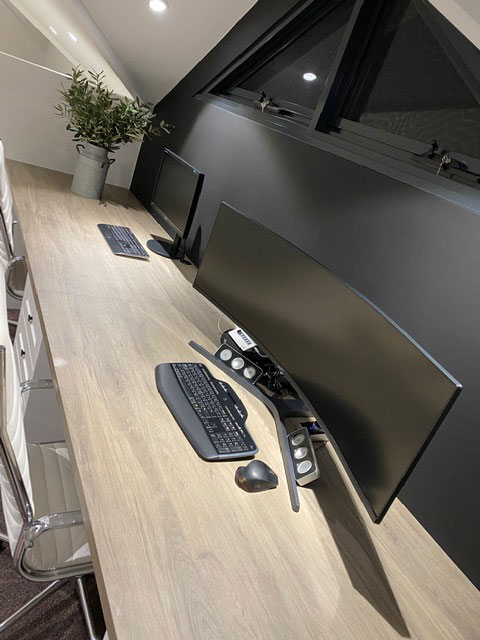
Image resolution: width=480 pixels, height=640 pixels. I want to click on computer monitor, so click(174, 191), click(309, 338).